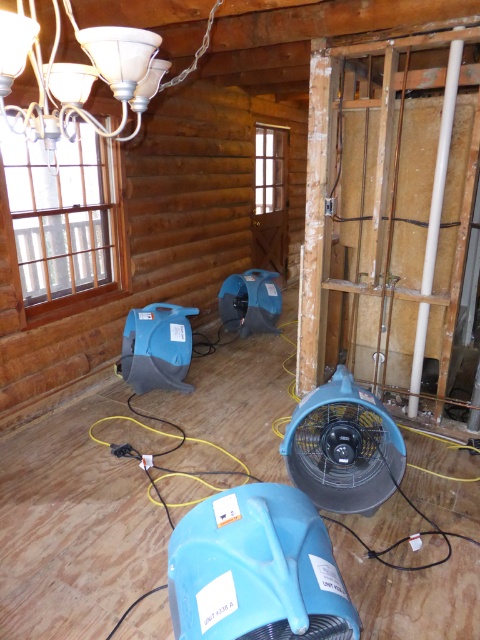
Consider the image. Which is more to the right, white frosted glass chandelier at upper left or blue plastic fan at center?

blue plastic fan at center

Which is in front, point (3, 92) or point (351, 378)?

Point (3, 92)

Where is `white frosted glass chandelier at upper left`? white frosted glass chandelier at upper left is located at coordinates (75, 74).